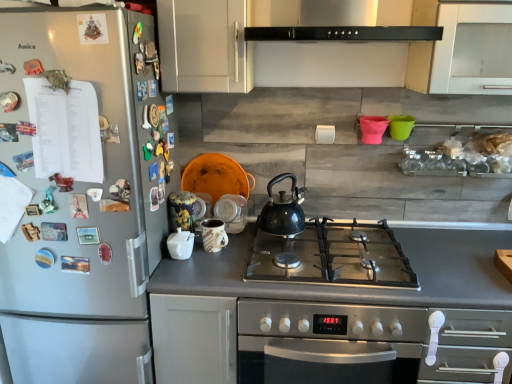
The width and height of the screenshot is (512, 384). What are the coordinates of `vacant area to the right of black matte kettle at center` in the screenshot? It's located at (330, 232).